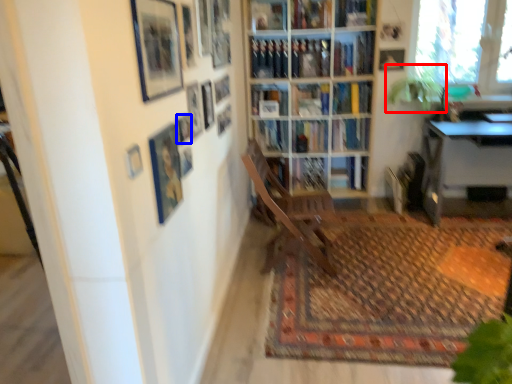
Question: Which of the following is the farthest to the observer, plant (highlighted by a red box) or picture frame (highlighted by a blue box)?

Choices:
 (A) plant
 (B) picture frame

Answer: (A)